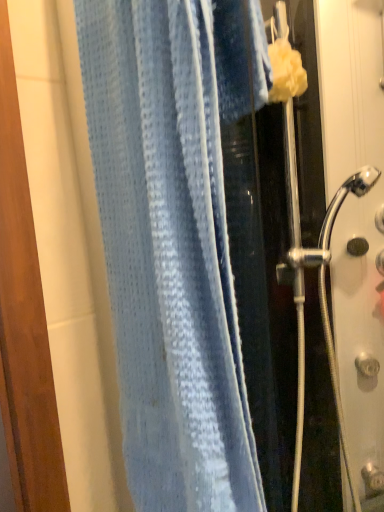
What do you see at coordinates (356, 223) in the screenshot? I see `clear glass shower door at right` at bounding box center [356, 223].

You are a GUI agent. You are given a task and a screenshot of the screen. Output one action in this format:
    pyautogui.click(x=<x>, y=<y>)
    Task: Click on the clear glass shower door at right
    
    Given the screenshot: What is the action you would take?
    pyautogui.click(x=356, y=223)

Describe the element at coordinates (171, 243) in the screenshot. This screenshot has height=512, width=384. I see `blue waffle-textured towel at center` at that location.

Find the location of a particular element. This screenshot has width=384, height=512. blue waffle-textured towel at center is located at coordinates (171, 243).

Identify the location of clear glass shower door at right. (356, 223).

Which object is positioned more to the left, clear glass shower door at right or blue waffle-textured towel at center?

blue waffle-textured towel at center.

Is the position of clear glass shower door at right more distant than that of blue waffle-textured towel at center?

Yes.

Does point (354, 423) lie behind point (189, 280)?

Yes, point (354, 423) is farther from viewer.

Based on the photo, from the image's perspective, is clear glass shower door at right located above blue waffle-textured towel at center?

No, from the image's perspective, clear glass shower door at right is not on top of blue waffle-textured towel at center.

From a real-world perspective, is clear glass shower door at right on blue waffle-textured towel at center?

No, from a real-world perspective, clear glass shower door at right is not over blue waffle-textured towel at center

Which object is thinner, clear glass shower door at right or blue waffle-textured towel at center?

Thinner between the two is blue waffle-textured towel at center.

Does clear glass shower door at right have a lesser height compared to blue waffle-textured towel at center?

No.

Considering the sizes of clear glass shower door at right and blue waffle-textured towel at center in the image, is clear glass shower door at right bigger or smaller than blue waffle-textured towel at center?

Clearly, clear glass shower door at right is larger in size than blue waffle-textured towel at center.

Can we say clear glass shower door at right lies outside blue waffle-textured towel at center?

clear glass shower door at right lies outside blue waffle-textured towel at center's area.

Is clear glass shower door at right far away from blue waffle-textured towel at center?

clear glass shower door at right is actually quite close to blue waffle-textured towel at center.

Is clear glass shower door at right positioned with its back to blue waffle-textured towel at center?

No, clear glass shower door at right's orientation is not away from blue waffle-textured towel at center.

How distant is clear glass shower door at right from blue waffle-textured towel at center?

clear glass shower door at right is 26.73 inches away from blue waffle-textured towel at center.

Identify the location of towel lying on the left of clear glass shower door at right. This screenshot has height=512, width=384. (171, 243).

Considering the positions of objects blue waffle-textured towel at center and clear glass shower door at right in the image provided, who is more to the right, blue waffle-textured towel at center or clear glass shower door at right?

clear glass shower door at right is more to the right.

Is blue waffle-textured towel at center further to camera compared to clear glass shower door at right?

No, it is in front of clear glass shower door at right.

Which is less distant, (181, 109) or (343, 262)?

Point (181, 109)

From the image's perspective, between blue waffle-textured towel at center and clear glass shower door at right, which one is located above?

blue waffle-textured towel at center.

From a real-world perspective, is blue waffle-textured towel at center positioned under clear glass shower door at right based on gravity?

Actually, blue waffle-textured towel at center is physically above clear glass shower door at right in the real world.

Does blue waffle-textured towel at center have a greater width compared to clear glass shower door at right?

In fact, blue waffle-textured towel at center might be narrower than clear glass shower door at right.

Which of these two, blue waffle-textured towel at center or clear glass shower door at right, stands taller?

Standing taller between the two is clear glass shower door at right.

Who is smaller, blue waffle-textured towel at center or clear glass shower door at right?

blue waffle-textured towel at center is smaller.

Is blue waffle-textured towel at center outside of clear glass shower door at right?

Yes, blue waffle-textured towel at center is located beyond the bounds of clear glass shower door at right.

Is blue waffle-textured towel at center beside clear glass shower door at right?

No, blue waffle-textured towel at center is not with clear glass shower door at right.

Could you tell me if blue waffle-textured towel at center is facing clear glass shower door at right?

No.

How different are the orientations of blue waffle-textured towel at center and clear glass shower door at right in degrees?

blue waffle-textured towel at center and clear glass shower door at right are facing 90 degrees away from each other.

Measure the distance from blue waffle-textured towel at center to clear glass shower door at right.

blue waffle-textured towel at center is 26.73 inches from clear glass shower door at right.

The height and width of the screenshot is (512, 384). I want to click on screen door lying below the blue waffle-textured towel at center (from the image's perspective), so click(356, 223).

Where is `towel that appears above the clear glass shower door at right (from the image's perspective)`? towel that appears above the clear glass shower door at right (from the image's perspective) is located at coordinates (171, 243).

What are the coordinates of `screen door below the blue waffle-textured towel at center (from the image's perspective)` in the screenshot? It's located at (356, 223).